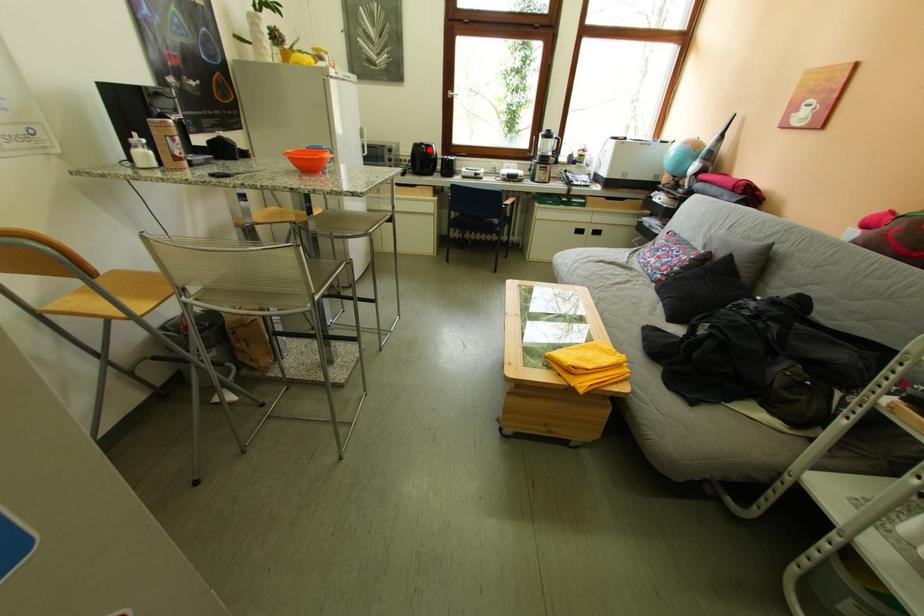
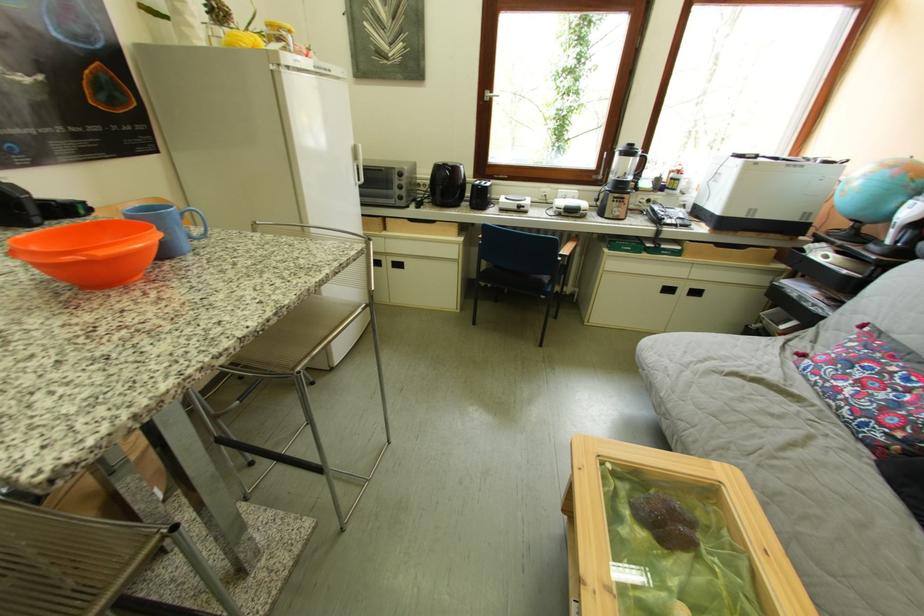
In the second image, find the point that corresponds to the highlighted location in the first image.

(451, 171)